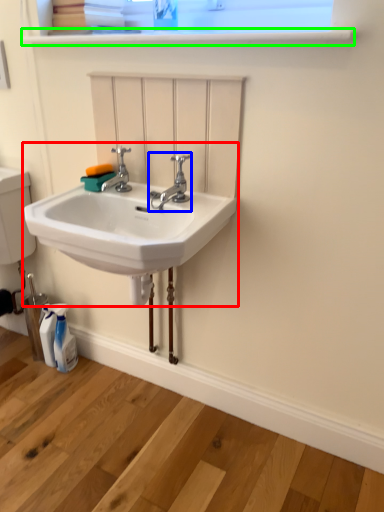
Question: Considering the real-world distances, which object is farthest from sink (highlighted by a red box)? tap (highlighted by a blue box) or window sill (highlighted by a green box)?

Choices:
 (A) tap
 (B) window sill

Answer: (B)